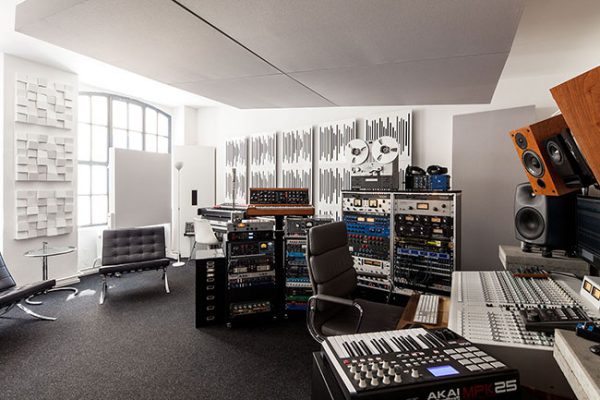
The height and width of the screenshot is (400, 600). I want to click on artwork, so click(55, 210), click(54, 163), click(63, 106).